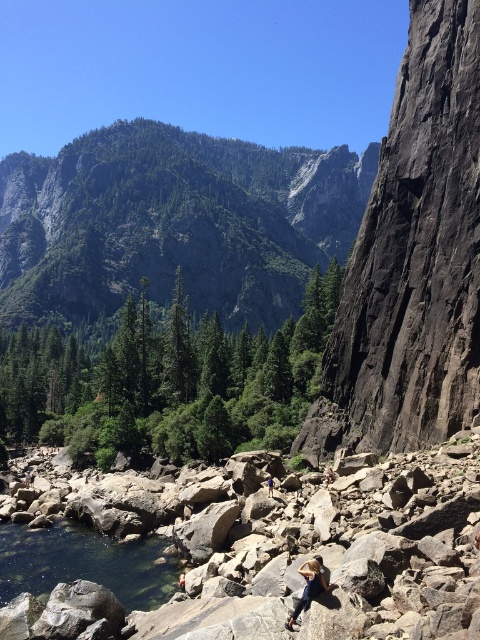
Find the location of a particular element. black rock cliff at right is located at coordinates (412, 259).

Measure the distance between point (257, 216) and camera.

Point (257, 216) is 250.54 meters from camera.

Is green forested mountain at upper center smaller than blue denim jeans at center?

Incorrect, green forested mountain at upper center is not smaller in size than blue denim jeans at center.

Between point (46, 272) and point (266, 481), which one is positioned behind?

The point (46, 272) is more distant.

At what (x,y) coordinates should I click in order to perform the action: click on green forested mountain at upper center. Please return your answer as a coordinate pair (x, y). The image size is (480, 640). Looking at the image, I should click on (172, 224).

Who is taller, green forested mountain at upper center or clear glass water at lower left?

Standing taller between the two is green forested mountain at upper center.

Can you confirm if green forested mountain at upper center is positioned above clear glass water at lower left?

Indeed, green forested mountain at upper center is positioned over clear glass water at lower left.

Between point (299, 189) and point (16, 547), which one is positioned behind?

Positioned behind is point (299, 189).

This screenshot has height=640, width=480. I want to click on green forested mountain at upper center, so click(x=172, y=224).